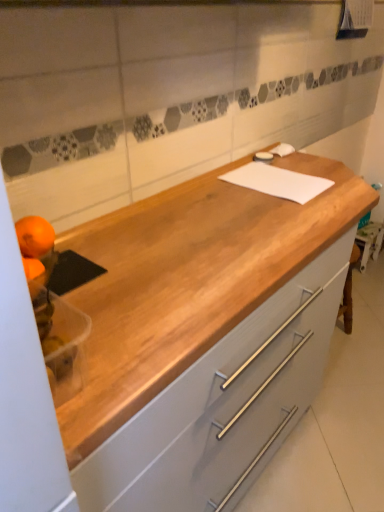
The height and width of the screenshot is (512, 384). Identify the location of free spot to the left of white matte cutting board at center. (218, 195).